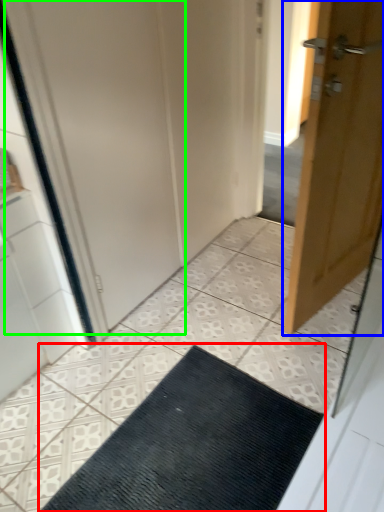
Question: Which is nearer to the doormat (highlighted by a red box)? door (highlighted by a blue box) or screen door (highlighted by a green box).

Choices:
 (A) door
 (B) screen door

Answer: (A)